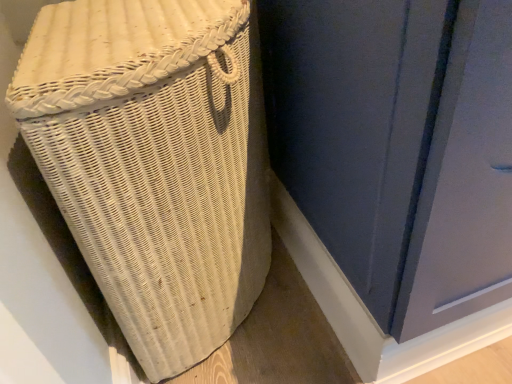
Identify the location of blank space situated above white wicker basket at left (from a real-world perspective). Image resolution: width=512 pixels, height=384 pixels. (123, 19).